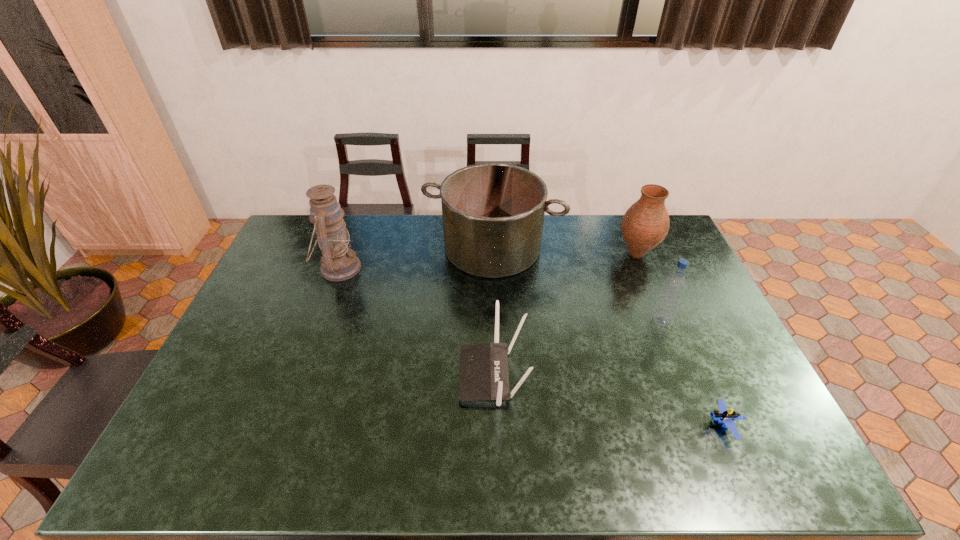
Image resolution: width=960 pixels, height=540 pixels. I want to click on vacant area that lies between the shortest object and the router, so click(609, 400).

This screenshot has width=960, height=540. Find the location of `free space between the Lego and the vase`. free space between the Lego and the vase is located at coordinates (680, 340).

Identify the location of unoccupied position between the second shortest object and the tallest object. (416, 322).

Where is `free point between the third nearest object and the pan`? This screenshot has width=960, height=540. free point between the third nearest object and the pan is located at coordinates (577, 285).

Locate an element on the screen. The height and width of the screenshot is (540, 960). free space between the leftmost object and the water bottle is located at coordinates (500, 295).

Image resolution: width=960 pixels, height=540 pixels. Find the location of `vacant area that lies between the leftmost object and the pan`. vacant area that lies between the leftmost object and the pan is located at coordinates (416, 258).

Image resolution: width=960 pixels, height=540 pixels. In order to click on free space between the fifth tallest object and the vase in this screenshot , I will do `click(564, 314)`.

Where is `free point between the Lego and the oil lamp`? This screenshot has height=540, width=960. free point between the Lego and the oil lamp is located at coordinates (531, 347).

The image size is (960, 540). Identify the location of unoccupied area between the water bottle and the pan. (577, 285).

This screenshot has height=540, width=960. Identify the location of vacant space in between the vase and the shortest object. (680, 340).